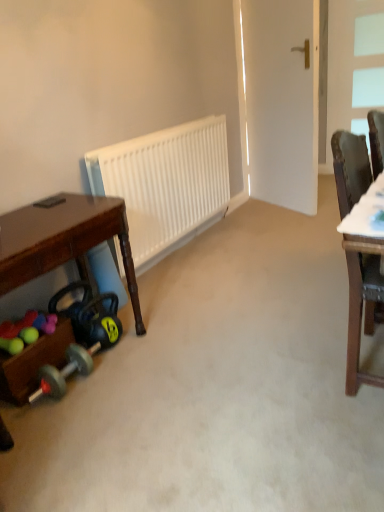
Question: Can you confirm if white glass window at upper right is bigger than wooden toy box at lower left?

Choices:
 (A) no
 (B) yes

Answer: (B)

Question: Can you confirm if white glass window at upper right is wider than wooden toy box at lower left?

Choices:
 (A) yes
 (B) no

Answer: (B)

Question: Does white glass window at upper right contain wooden toy box at lower left?

Choices:
 (A) yes
 (B) no

Answer: (B)

Question: Would you say white glass window at upper right is outside wooden toy box at lower left?

Choices:
 (A) no
 (B) yes

Answer: (B)

Question: Is white glass window at upper right thinner than wooden toy box at lower left?

Choices:
 (A) yes
 (B) no

Answer: (A)

Question: Would you say white glass window at upper right is inside or outside brown wood chair at right?

Choices:
 (A) outside
 (B) inside

Answer: (A)

Question: From the image's perspective, is white glass window at upper right above or below brown wood chair at right?

Choices:
 (A) below
 (B) above

Answer: (B)

Question: In terms of height, does white glass window at upper right look taller or shorter compared to brown wood chair at right?

Choices:
 (A) tall
 (B) short

Answer: (A)

Question: From a real-world perspective, is white glass window at upper right above or below brown wood chair at right?

Choices:
 (A) below
 (B) above

Answer: (B)

Question: Is brown wood chair at right situated inside rubberized plastic balls at lower left or outside?

Choices:
 (A) inside
 (B) outside

Answer: (B)

Question: From the image's perspective, is brown wood chair at right positioned above or below rubberized plastic balls at lower left?

Choices:
 (A) below
 (B) above

Answer: (B)

Question: Is brown wood chair at right to the left or to the right of rubberized plastic balls at lower left in the image?

Choices:
 (A) right
 (B) left

Answer: (A)

Question: In the image, is brown wood chair at right positioned in front of or behind rubberized plastic balls at lower left?

Choices:
 (A) front
 (B) behind

Answer: (A)

Question: Considering their positions, is white glass window at upper right located in front of or behind white matte radiator at center?

Choices:
 (A) front
 (B) behind

Answer: (B)

Question: From a real-world perspective, relative to white matte radiator at center, is white glass window at upper right vertically above or below?

Choices:
 (A) above
 (B) below

Answer: (A)